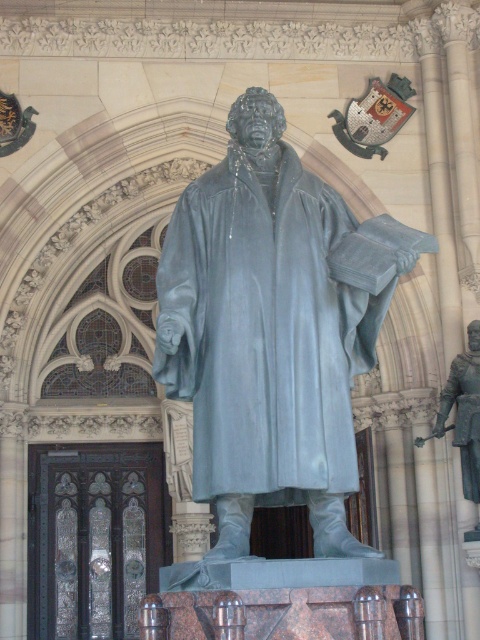
You are an art student standing in front of the statue. You need to sketch both the matte gray statue at center and the polished bronze knight at right. Based on their positions, which one should you sketch first to follow the natural left to right viewing order?

The matte gray statue at center should be sketched first as it is positioned to the left of the polished bronze knight at right, following the natural left to right viewing order.

You are standing in front of the statue and notice two points marked in the image. The first point is at coordinates point (251, 273) and the second is at point (474, 458). Which point is nearer to you?

Point (251, 273) is closer to the viewer than point (474, 458).

You are an architect analyzing the placement of the matte gray statue at center in the historic building. Based on the coordinates provided, is the statue positioned closer to the front or the back of the room?

The coordinates of the matte gray statue at center are at point (265, 333), which places it near the center of the room. Therefore, it is neither closer to the front nor the back of the room.